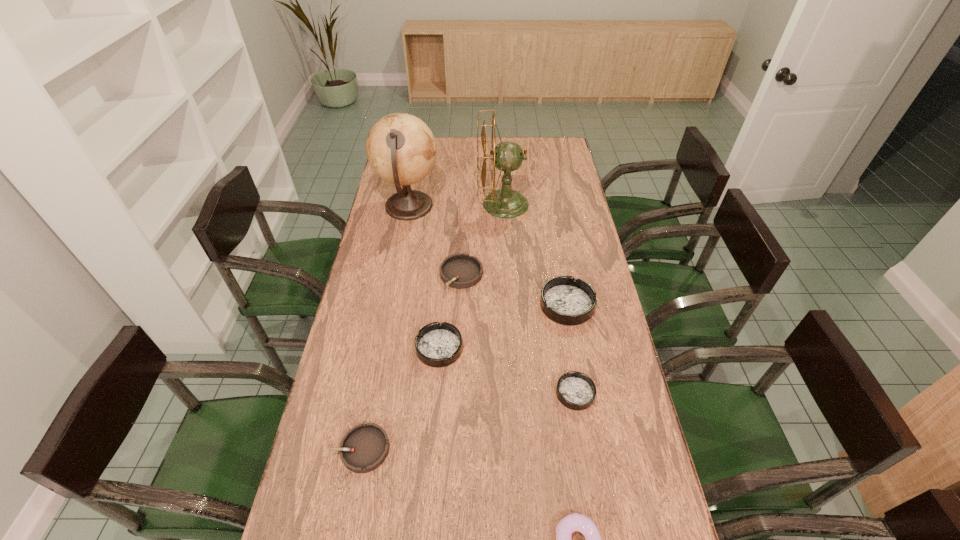
This screenshot has width=960, height=540. What are the coordinates of `free area in between the globe and the second smallest dark ashtray` in the screenshot? It's located at (424, 278).

Where is `vacant area between the leftmost dark ashtray and the right gray ashtray`? vacant area between the leftmost dark ashtray and the right gray ashtray is located at coordinates pos(450,312).

Image resolution: width=960 pixels, height=540 pixels. What are the coordinates of `blank region between the left gray ashtray and the globe` in the screenshot? It's located at (385, 328).

Locate which object is the fourth closest to the leftmost ashtray. Please provide its 2D coordinates. Your answer should be formatted as a tuple, i.e. [(x, y)], where the tuple contains the x and y coordinates of a point satisfying the conditions above.

[(460, 271)]

Choose which object is the nearest neighbor to the nearer gray ashtray. Please provide its 2D coordinates. Your answer should be formatted as a tuple, i.e. [(x, y)], where the tuple contains the x and y coordinates of a point satisfying the conditions above.

[(437, 344)]

Choose which ashtray is the fourth nearest neighbor to the biggest dark ashtray. Please provide its 2D coordinates. Your answer should be formatted as a tuple, i.e. [(x, y)], where the tuple contains the x and y coordinates of a point satisfying the conditions above.

[(364, 448)]

At what (x,y) coordinates should I click in order to perform the action: click on ashtray object that ranks as the third closest to the leftmost dark ashtray. Please return your answer as a coordinate pair (x, y). Looking at the image, I should click on (567, 301).

Locate which dark ashtray ranks second in proximity to the doughnut. Please provide its 2D coordinates. Your answer should be formatted as a tuple, i.e. [(x, y)], where the tuple contains the x and y coordinates of a point satisfying the conditions above.

[(437, 344)]

Where is `the second closest dark ashtray to the third nearest object`? The image size is (960, 540). the second closest dark ashtray to the third nearest object is located at coordinates (437, 344).

This screenshot has height=540, width=960. What are the coordinates of `vacant region that satisfies the following two spatial constraints: 1. on the front-facing side of the globe; 2. on the back side of the bigger gray ashtray` in the screenshot? It's located at (396, 275).